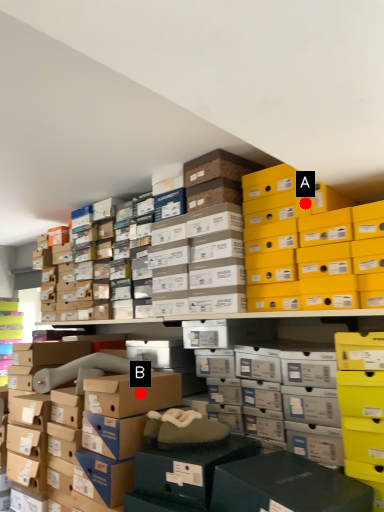
Question: Two points are circled on the image, labeled by A and B beside each circle. Which point is further to the camera?

Choices:
 (A) A is further
 (B) B is further

Answer: (A)